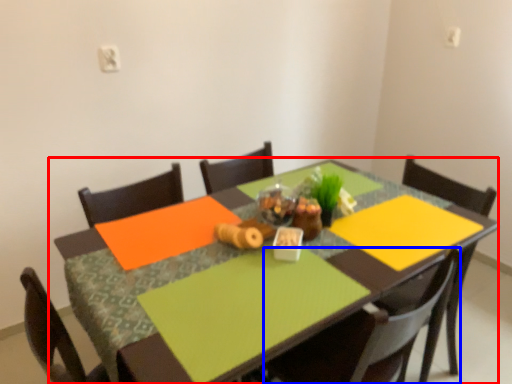
Question: Which object appears closest to the camera in this image, table (highlighted by a red box) or chair (highlighted by a blue box)?

Choices:
 (A) table
 (B) chair

Answer: (A)